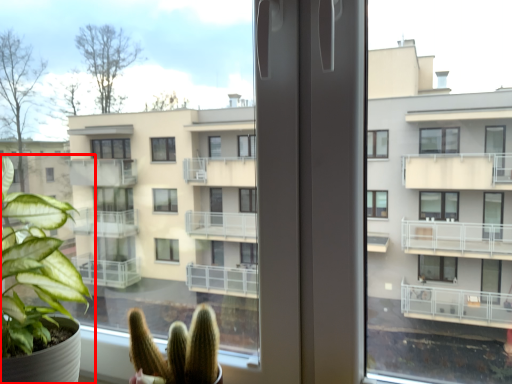
Question: Where is houseplant (annotated by the red box) located in relation to houseplant in the image?

Choices:
 (A) left
 (B) right

Answer: (A)